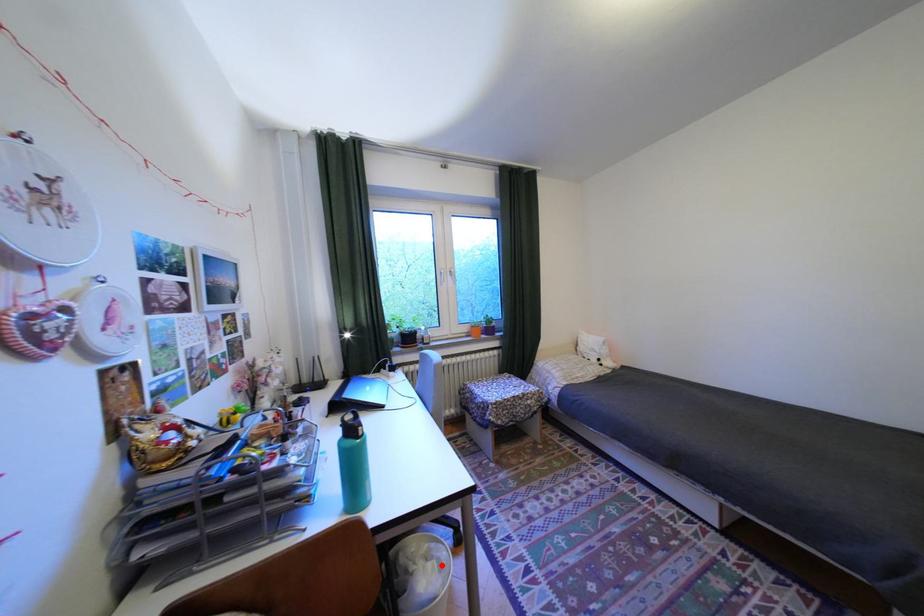
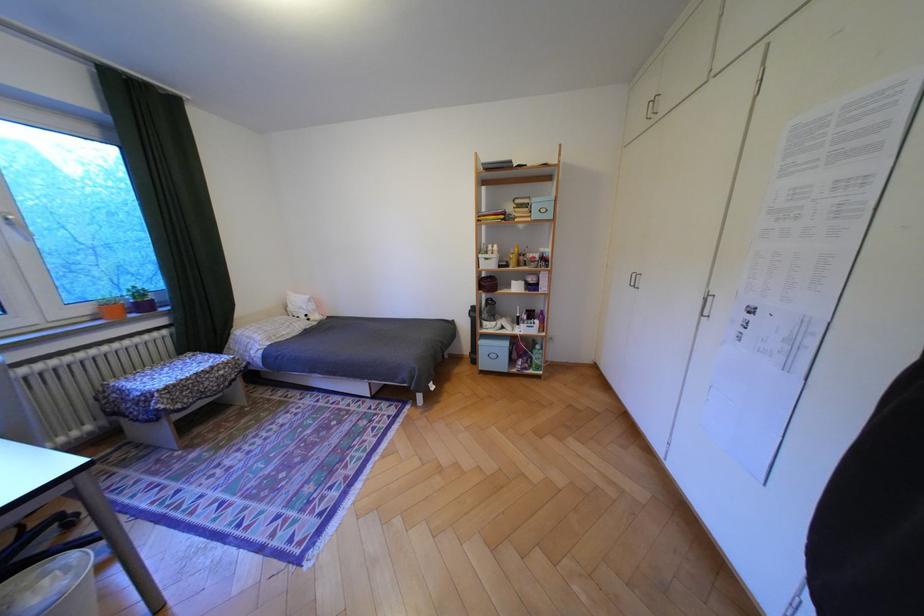
In the second image, find the point that corresponds to the highlighted location in the first image.

(56, 582)